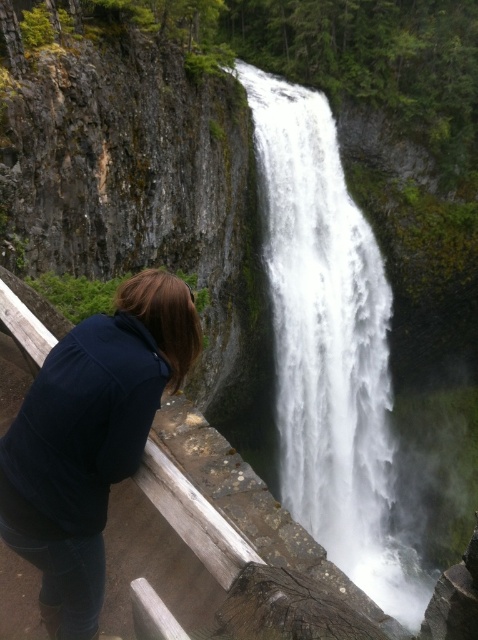
Question: Observing the image, what is the correct spatial positioning of white frothy water at center in reference to dark blue hoodie at lower left?

Choices:
 (A) below
 (B) above

Answer: (B)

Question: Can you confirm if white frothy water at center is positioned to the left of dark blue hoodie at lower left?

Choices:
 (A) no
 (B) yes

Answer: (A)

Question: Does white frothy water at center lie behind dark blue hoodie at lower left?

Choices:
 (A) yes
 (B) no

Answer: (A)

Question: Which point is farther to the camera?

Choices:
 (A) (69, 349)
 (B) (358, 477)

Answer: (B)

Question: Which object is closer to the camera taking this photo?

Choices:
 (A) white frothy water at center
 (B) dark blue hoodie at lower left

Answer: (B)